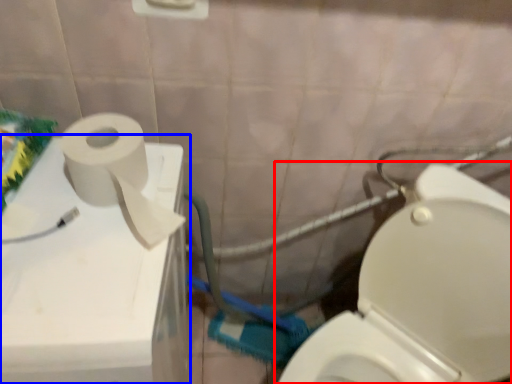
Question: Which point is closer to the camera, toilet (highlighted by a red box) or appliance (highlighted by a blue box)?

Choices:
 (A) toilet
 (B) appliance

Answer: (A)